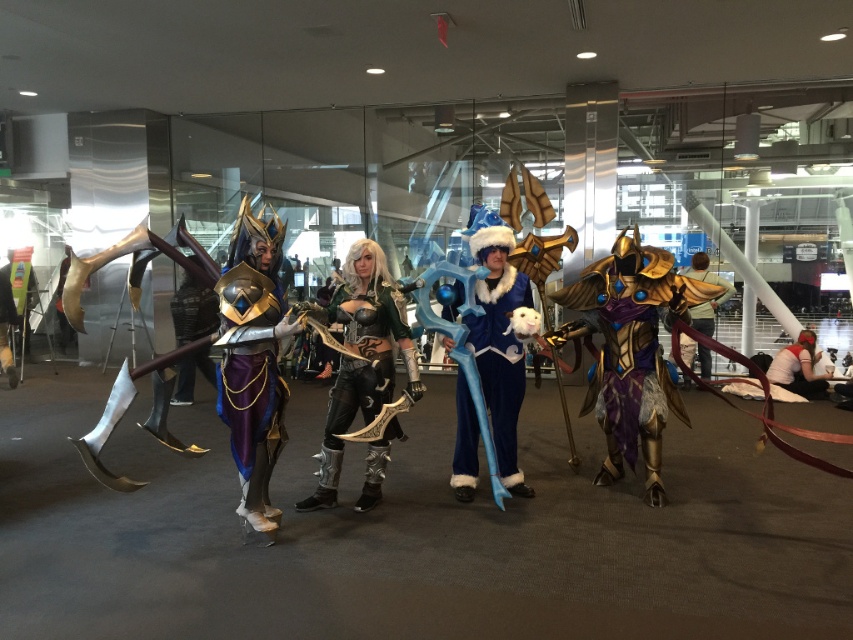
Question: In this image, where is black leather armor at center located relative to white fabric shirt at lower right?

Choices:
 (A) below
 (B) above

Answer: (B)

Question: Does gold metallic armor at right appear on the right side of metallic purple armor at center?

Choices:
 (A) no
 (B) yes

Answer: (B)

Question: Among these objects, which one is nearest to the camera?

Choices:
 (A) green metallic armor at center
 (B) white fabric shirt at lower right

Answer: (A)

Question: Is black leather armor at center to the right of blue plush/soft at center from the viewer's perspective?

Choices:
 (A) yes
 (B) no

Answer: (B)

Question: Which of the following is the farthest from the observer?

Choices:
 (A) gold metallic armor at right
 (B) white fabric shirt at lower right
 (C) gold metallic armor at center
 (D) green metallic armor at center

Answer: (B)

Question: Which point is farther to the camera?

Choices:
 (A) white fabric shirt at lower right
 (B) gold metallic armor at right
 (C) gold metallic armor at center
 (D) metallic purple armor at center

Answer: (A)